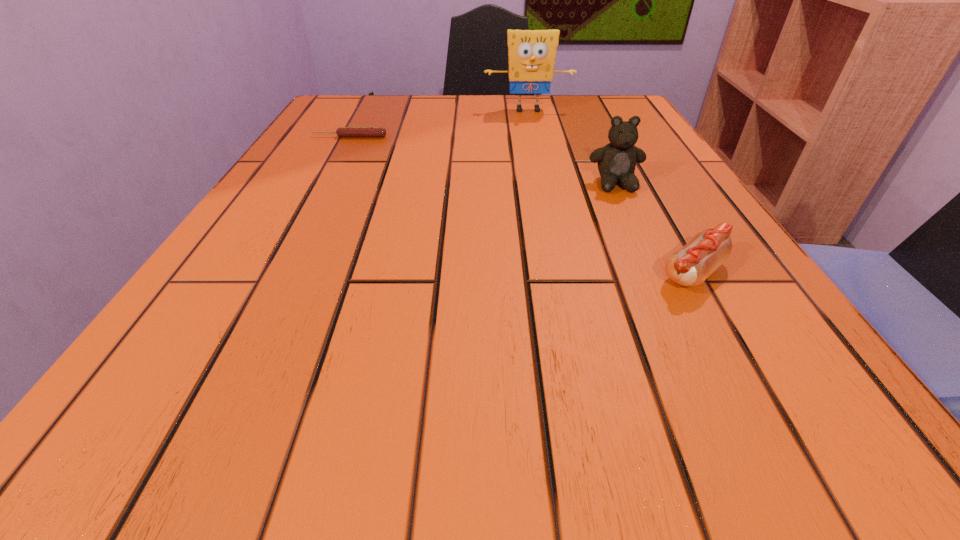
Identify the location of free region at the right edge of the desktop. This screenshot has height=540, width=960. [736, 278].

Image resolution: width=960 pixels, height=540 pixels. I want to click on free space at the far left corner of the desktop, so click(363, 110).

This screenshot has width=960, height=540. Find the location of `vacant position at the near left corner of the desktop`. vacant position at the near left corner of the desktop is located at coordinates (260, 426).

The width and height of the screenshot is (960, 540). In the image, there is a desktop. Identify the location of vacant space at the far right corner. (576, 103).

Where is `free spot between the second nearest object and the nearer sausage`? This screenshot has height=540, width=960. free spot between the second nearest object and the nearer sausage is located at coordinates (655, 228).

Locate an element on the screen. This screenshot has height=540, width=960. free spot between the second farthest object and the taller sausage is located at coordinates (521, 205).

You are a GUI agent. You are given a task and a screenshot of the screen. Output one action in this format:
    pyautogui.click(x=<x>, y=<y>)
    Task: Click on the unoccupied area between the left sausage and the nearest object
    
    Given the screenshot: What is the action you would take?
    pyautogui.click(x=521, y=205)

Locate an element on the screen. The height and width of the screenshot is (540, 960). free area in between the tallest object and the third shortest object is located at coordinates (571, 147).

Find the location of a particular element. Image resolution: width=960 pixels, height=540 pixels. vacant space that is in between the shorter sausage and the second nearest object is located at coordinates (483, 160).

Find the location of a particular element. The image size is (960, 540). free spot between the third shortest object and the tallest object is located at coordinates (571, 147).